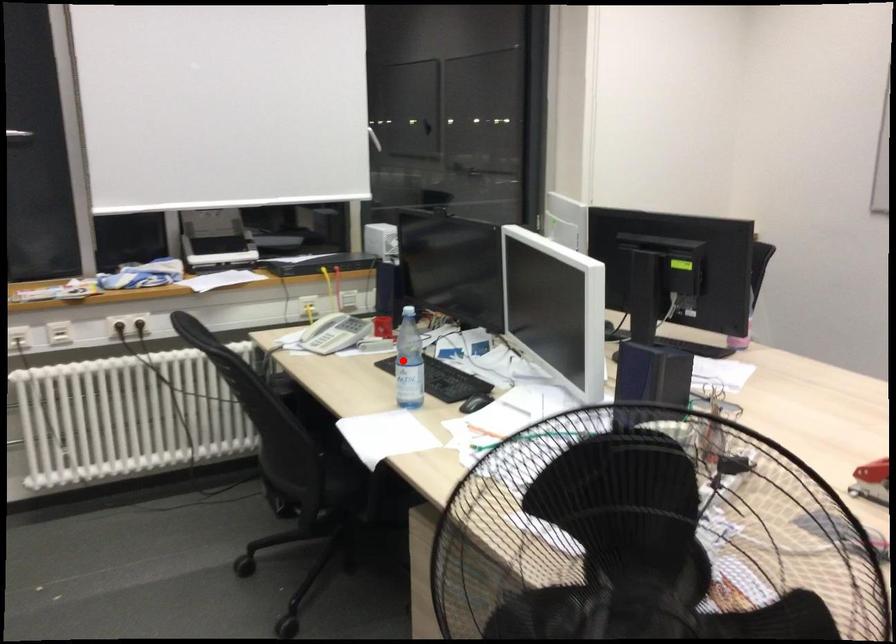
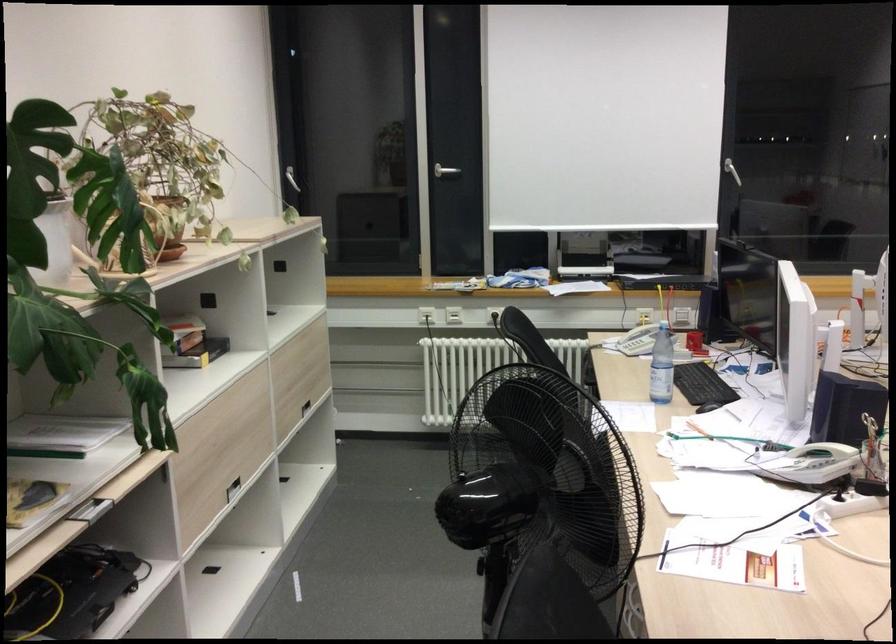
Where in the second image is the point corresponding to the highlighted location from the first image?

(661, 366)